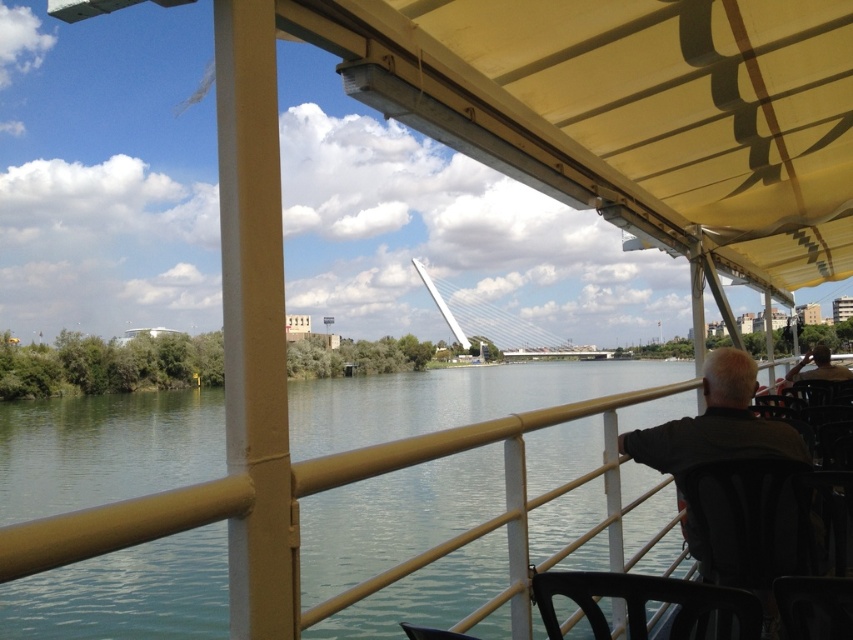
Can you confirm if greenish water at center is wider than dark gray fabric jacket at right?

Yes.

You are a GUI agent. You are given a task and a screenshot of the screen. Output one action in this format:
    pyautogui.click(x=<x>, y=<y>)
    Task: Click on the greenish water at center
    The height and width of the screenshot is (640, 853).
    Given the screenshot: What is the action you would take?
    pyautogui.click(x=469, y=484)

Does dark gray fabric jacket at right appear on the right side of black plastic chair at lower center?

Correct, you'll find dark gray fabric jacket at right to the right of black plastic chair at lower center.

Is dark gray fabric jacket at right further to camera compared to black plastic chair at lower center?

Yes, dark gray fabric jacket at right is behind black plastic chair at lower center.

Does point (723, 448) come closer to viewer compared to point (666, 598)?

No, it is behind (666, 598).

Locate an element on the screen. This screenshot has width=853, height=640. dark gray fabric jacket at right is located at coordinates (714, 433).

From the picture: Is greenish water at center wider than black plastic chair at lower center?

Yes.

Which is in front, point (364, 392) or point (740, 600)?

Positioned in front is point (740, 600).

This screenshot has width=853, height=640. What do you see at coordinates (469, 484) in the screenshot?
I see `greenish water at center` at bounding box center [469, 484].

The height and width of the screenshot is (640, 853). I want to click on greenish water at center, so click(469, 484).